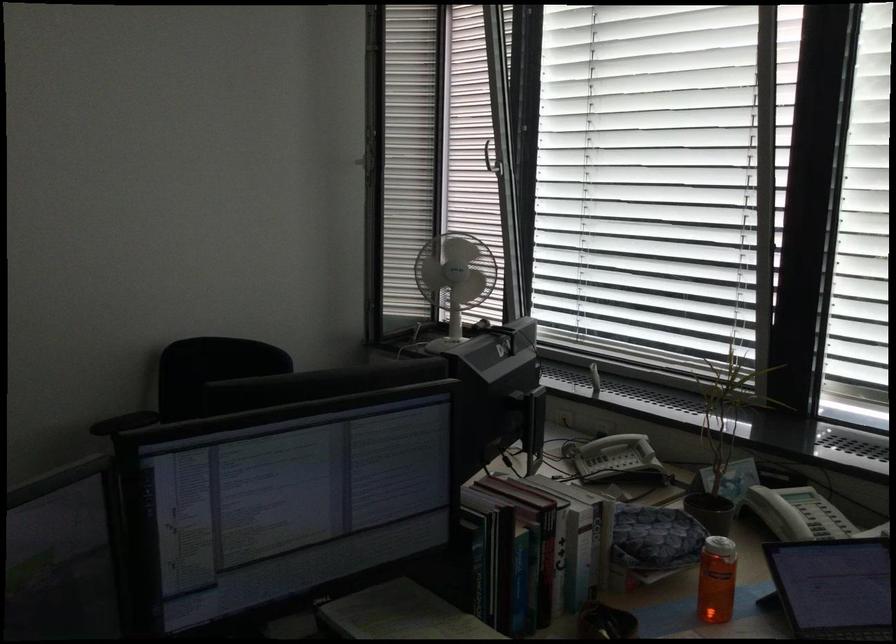
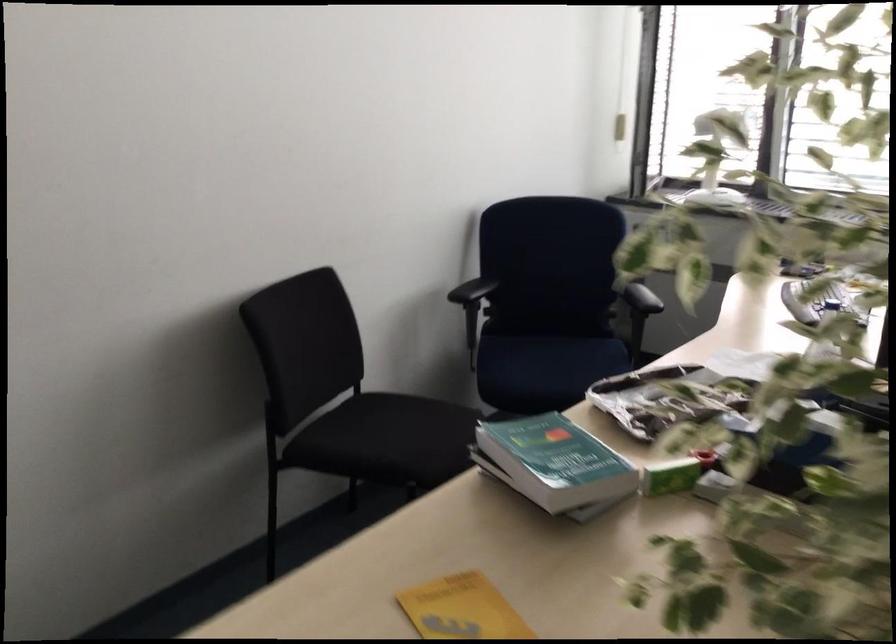
Question: The images are taken continuously from a first-person perspective. In which direction are you moving?

Choices:
 (A) Left
 (B) Right
 (C) Forward
 (D) Backward

Answer: (A)